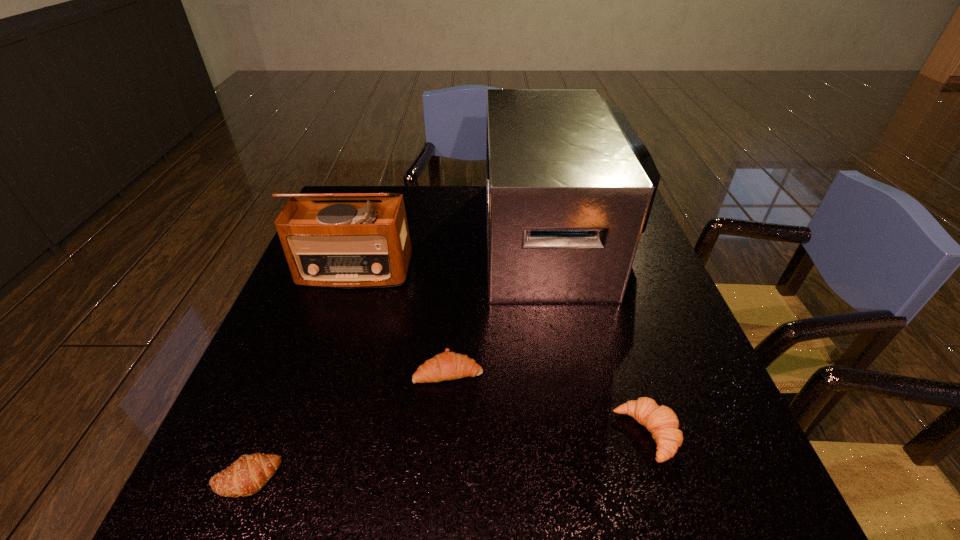
The height and width of the screenshot is (540, 960). I want to click on object that is at the near right corner, so click(x=661, y=421).

Identify the location of vacant space at the far edge of the desktop. This screenshot has width=960, height=540. (474, 222).

Locate an element on the screen. The image size is (960, 540). vacant space at the left edge of the desktop is located at coordinates (276, 331).

This screenshot has width=960, height=540. I want to click on blank space at the right edge of the desktop, so click(638, 373).

In the image, there is a desktop. Where is `free space at the near left corner`? The width and height of the screenshot is (960, 540). free space at the near left corner is located at coordinates (202, 488).

Locate an element on the screen. The height and width of the screenshot is (540, 960). unoccupied area between the third nearest object and the radio receiver is located at coordinates (401, 320).

Locate an element on the screen. free space between the microwave oven and the rightmost crescent roll is located at coordinates (602, 335).

Locate an element on the screen. This screenshot has width=960, height=540. blank region between the second crescent roll from right to left and the radio receiver is located at coordinates (401, 320).

Locate an element on the screen. This screenshot has width=960, height=540. vacant area that lies between the radio receiver and the second crescent roll from left to right is located at coordinates (401, 320).

This screenshot has width=960, height=540. Identify the location of vacant point located between the leftmost crescent roll and the radio receiver. (300, 374).